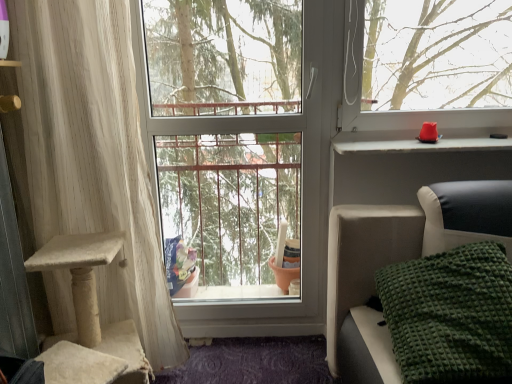
Question: In terms of height, does green textured blanket at lower right look taller or shorter compared to matte plastic window sill at upper right?

Choices:
 (A) short
 (B) tall

Answer: (B)

Question: Is green textured blanket at lower right wider or thinner than matte plastic window sill at upper right?

Choices:
 (A) wide
 (B) thin

Answer: (A)

Question: Which of these objects is positioned farthest from the white textured curtain at left?

Choices:
 (A) matte plastic window sill at upper right
 (B) transparent glass window at center
 (C) green textured blanket at lower right

Answer: (A)

Question: Which object is the closest to the white textured curtain at left?

Choices:
 (A) transparent glass window at center
 (B) green textured blanket at lower right
 (C) matte plastic window sill at upper right

Answer: (A)